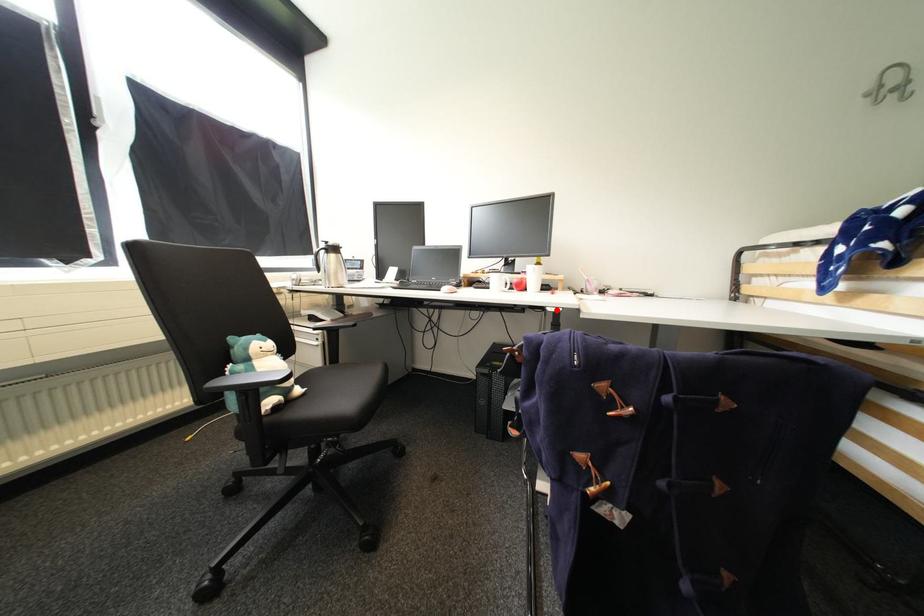
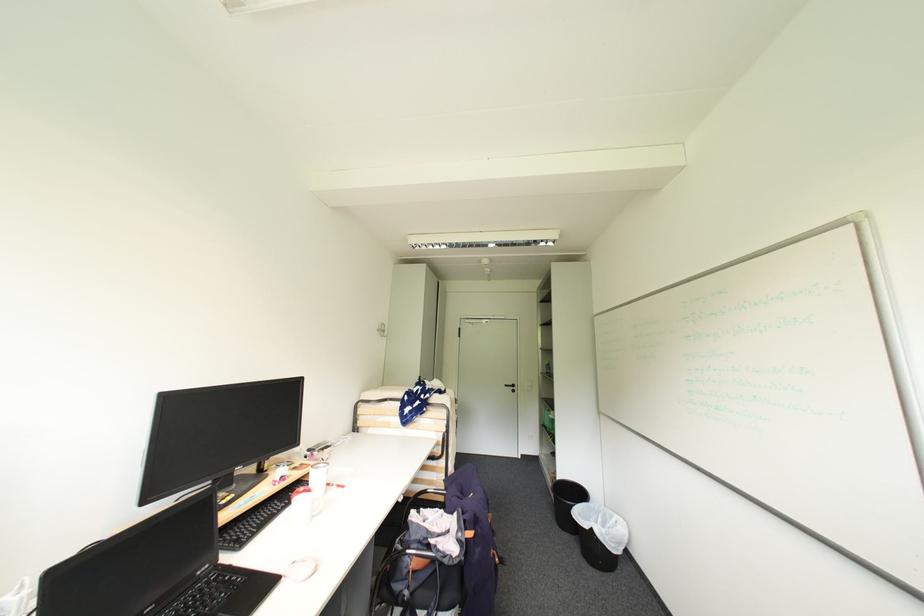
In the second image, find the point that corresponds to the highlighted location in the first image.

(407, 501)